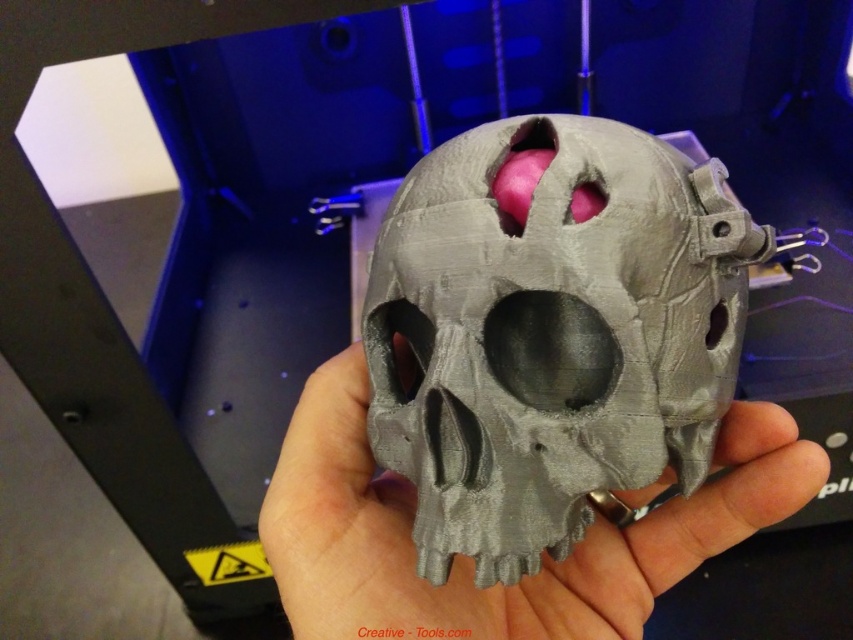
Between matte gray skull at center and gray matte skull at center, which one appears on the right side from the viewer's perspective?

Positioned to the right is gray matte skull at center.

Between matte gray skull at center and gray matte skull at center, which one is positioned higher?

matte gray skull at center

Image resolution: width=853 pixels, height=640 pixels. What do you see at coordinates (550, 333) in the screenshot? I see `matte gray skull at center` at bounding box center [550, 333].

What are the coordinates of `matte gray skull at center` in the screenshot? It's located at (550, 333).